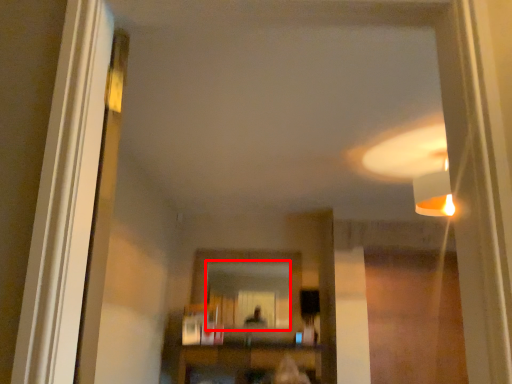
Question: From the image's perspective, considering the relative positions of mirror (annotated by the red box) and furniture in the image provided, where is mirror (annotated by the red box) located with respect to the staircase?

Choices:
 (A) above
 (B) below

Answer: (A)